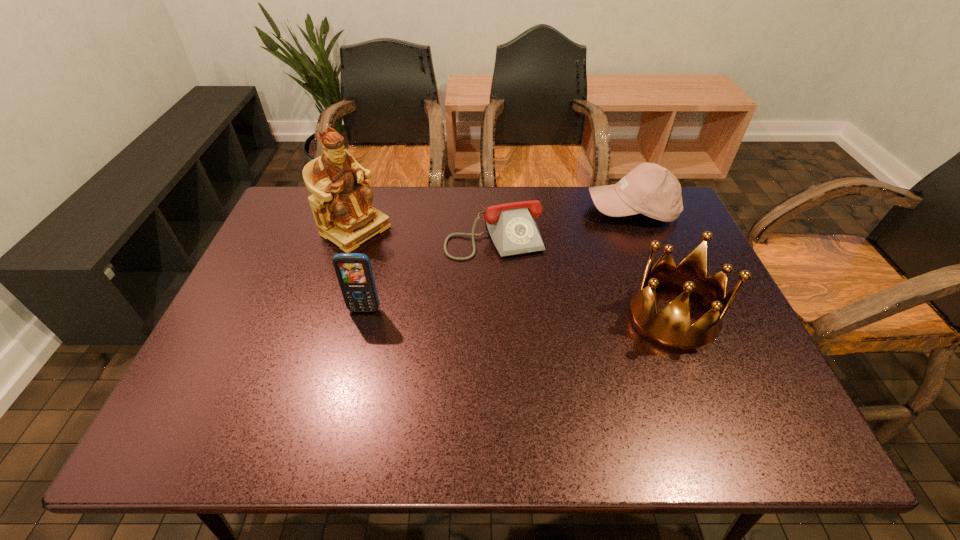
I want to click on free location located on the front-facing side of the tallest object, so click(423, 276).

Find the location of a particular element. This screenshot has height=540, width=960. free location located 0.380m on the dial of the shortest object is located at coordinates (551, 376).

You are a GUI agent. You are given a task and a screenshot of the screen. Output one action in this format:
    pyautogui.click(x=<x>, y=<y>)
    Task: Click on the vacant space located 0.280m on the dial of the shortest object
    This screenshot has width=960, height=540.
    Given the screenshot: What is the action you would take?
    pyautogui.click(x=537, y=340)

At what (x,y) coordinates should I click in order to perform the action: click on vacant space located 0.310m on the dial of the shortest object. Please return your answer as a coordinate pair (x, y). Image resolution: width=960 pixels, height=540 pixels. Looking at the image, I should click on (540, 350).

Where is `free region located on the front-facing side of the fourth tallest object`? free region located on the front-facing side of the fourth tallest object is located at coordinates (551, 308).

Locate an element on the screen. vacant space located 0.320m on the front-facing side of the fourth tallest object is located at coordinates (565, 289).

The width and height of the screenshot is (960, 540). Identify the location of vacant space situated on the front-facing side of the fourth tallest object. (594, 248).

Locate an element on the screen. figurine at the far edge is located at coordinates (341, 203).

Where is `telephone located in the far edge section of the desktop`? The width and height of the screenshot is (960, 540). telephone located in the far edge section of the desktop is located at coordinates (512, 227).

You are a GUI agent. You are given a task and a screenshot of the screen. Output one action in this format:
    pyautogui.click(x=<x>, y=<y>)
    Task: Click on the baseball cap that is at the far edge
    Image resolution: width=960 pixels, height=540 pixels.
    Given the screenshot: What is the action you would take?
    pyautogui.click(x=649, y=189)